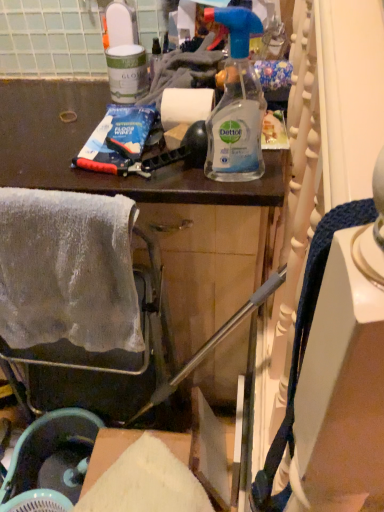
Question: From the image's perspective, is white matte paper towel at center above or below matte black cabinet at upper center?

Choices:
 (A) above
 (B) below

Answer: (A)

Question: Is white matte paper towel at center inside or outside of matte black cabinet at upper center?

Choices:
 (A) inside
 (B) outside

Answer: (B)

Question: Which of these objects is positioned closest to the matte black cabinet at upper center?

Choices:
 (A) white matte paper towel at center
 (B) white fluffy towel at left
 (C) white glossy paint can at upper left, the 1th bottle when ordered from top to bottom
 (D) clear plastic spray bottle at center, marked as the 1th bottle in a right-to-left arrangement

Answer: (C)

Question: Which is farther from the matte black cabinet at upper center?

Choices:
 (A) white fluffy towel at left
 (B) white glossy paint can at upper left, marked as the 2th bottle in a bottom-to-top arrangement
 (C) clear plastic spray bottle at center, the first bottle viewed from the front
 (D) white matte paper towel at center

Answer: (D)